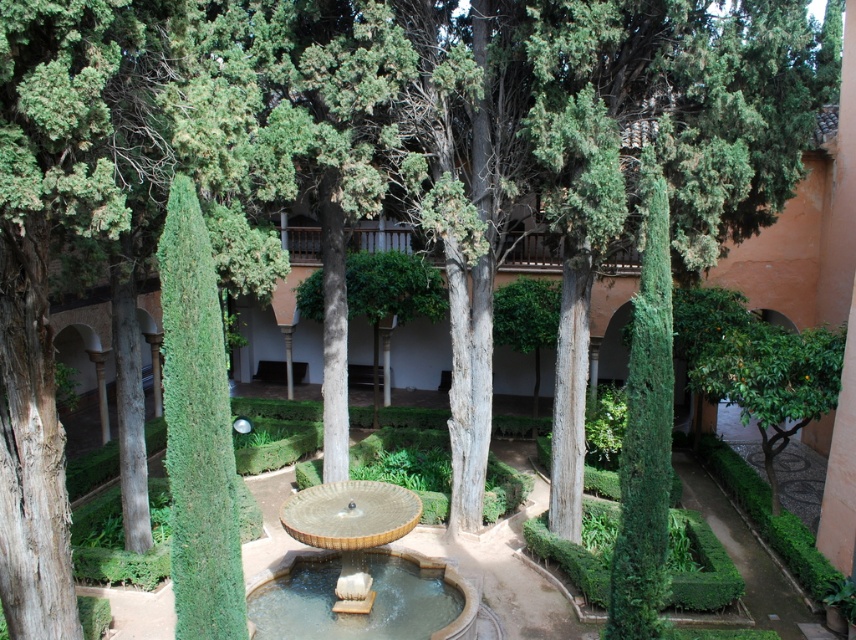
What are the coordinates of the gold textured basin at center in the image?

The coordinates of the gold textured basin at center are at point (361, 545).

You are standing in the courtyard and see a point marked at coordinates [361,545]. What object is located at that point?

The point at coordinates [361,545] marks the gold textured basin at center.